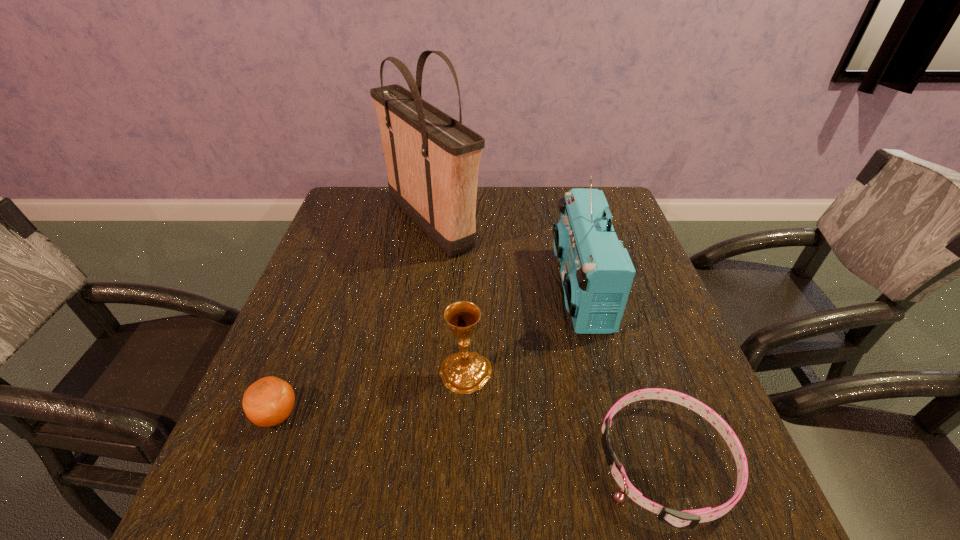
The width and height of the screenshot is (960, 540). What are the coordinates of `empty location between the second tallest object and the orange` in the screenshot? It's located at (428, 352).

Find the location of a particular element. The image size is (960, 540). free space between the shopping bag and the shortest object is located at coordinates (548, 343).

Identify the location of free space that is in between the orange and the third nearest object. The width and height of the screenshot is (960, 540). (372, 394).

Image resolution: width=960 pixels, height=540 pixels. Identify the location of free area in between the shopping bag and the fourth shortest object. (505, 256).

Where is `vacant space in between the chalice and the shortest object`? vacant space in between the chalice and the shortest object is located at coordinates click(x=566, y=417).

Locate an element on the screen. The height and width of the screenshot is (540, 960). unoccupied position between the shortest object and the second tallest object is located at coordinates (623, 375).

You are a GUI agent. You are given a task and a screenshot of the screen. Output one action in this format:
    pyautogui.click(x=<x>, y=<y>)
    Task: Click on the vacant space that is in between the third shortest object and the second tallest object
    
    Given the screenshot: What is the action you would take?
    pyautogui.click(x=523, y=330)

Where is `free space between the dog collar and the tallest object`? The height and width of the screenshot is (540, 960). free space between the dog collar and the tallest object is located at coordinates (548, 343).

The image size is (960, 540). In order to click on vacant point located between the third shortest object and the tallest object in this screenshot , I will do `click(448, 298)`.

Locate an element on the screen. vacant area between the leftmost object and the dog collar is located at coordinates (471, 439).